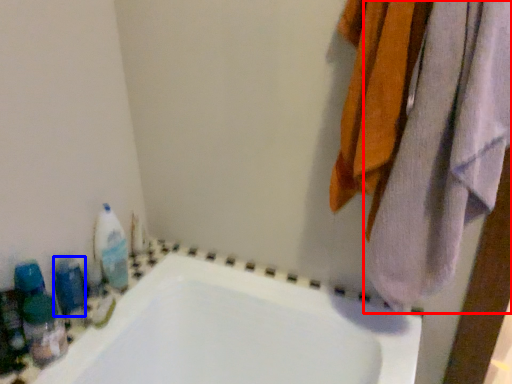
Question: Among these objects, which one is nearest to the camera, towel (highlighted by a red box) or toiletry (highlighted by a blue box)?

Choices:
 (A) towel
 (B) toiletry

Answer: (A)